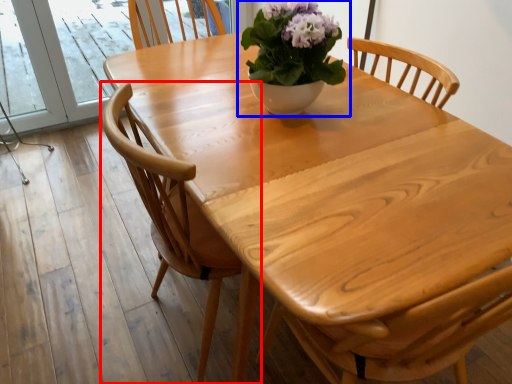
Question: Which object is further to the camera taking this photo, chair (highlighted by a red box) or houseplant (highlighted by a blue box)?

Choices:
 (A) chair
 (B) houseplant

Answer: (B)